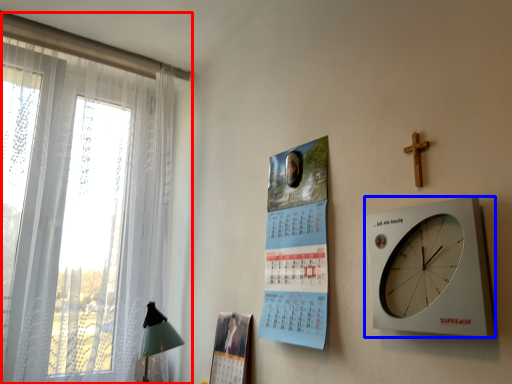
Question: Which object appears closest to the camera in this image, window (highlighted by a red box) or wall clock (highlighted by a blue box)?

Choices:
 (A) window
 (B) wall clock

Answer: (B)